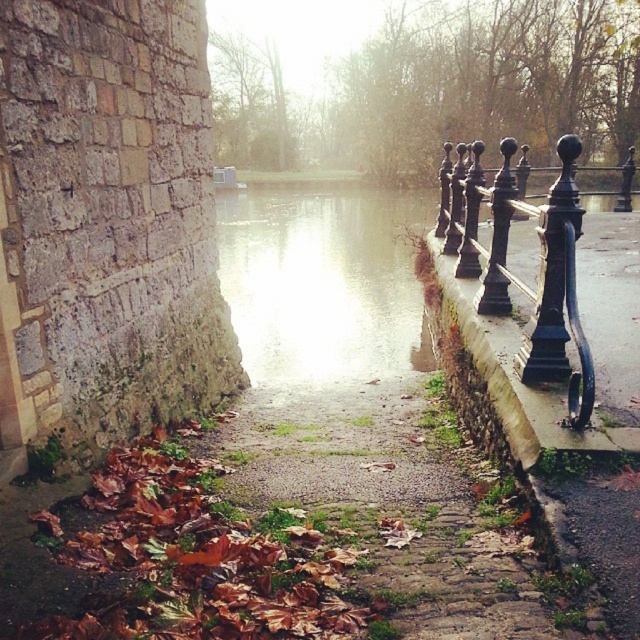
Question: Which of the following is the closest to the observer?

Choices:
 (A) (356, 266)
 (B) (556, 314)

Answer: (B)

Question: Can you confirm if glistening water at center is positioned to the right of black wrought iron fence at right?

Choices:
 (A) no
 (B) yes

Answer: (A)

Question: Is glistening water at center to the right of black wrought iron fence at right from the viewer's perspective?

Choices:
 (A) yes
 (B) no

Answer: (B)

Question: Which point appears closest to the camera in this image?

Choices:
 (A) (496, 262)
 (B) (316, 342)

Answer: (A)

Question: Can you confirm if glistening water at center is wider than black wrought iron fence at right?

Choices:
 (A) yes
 (B) no

Answer: (A)